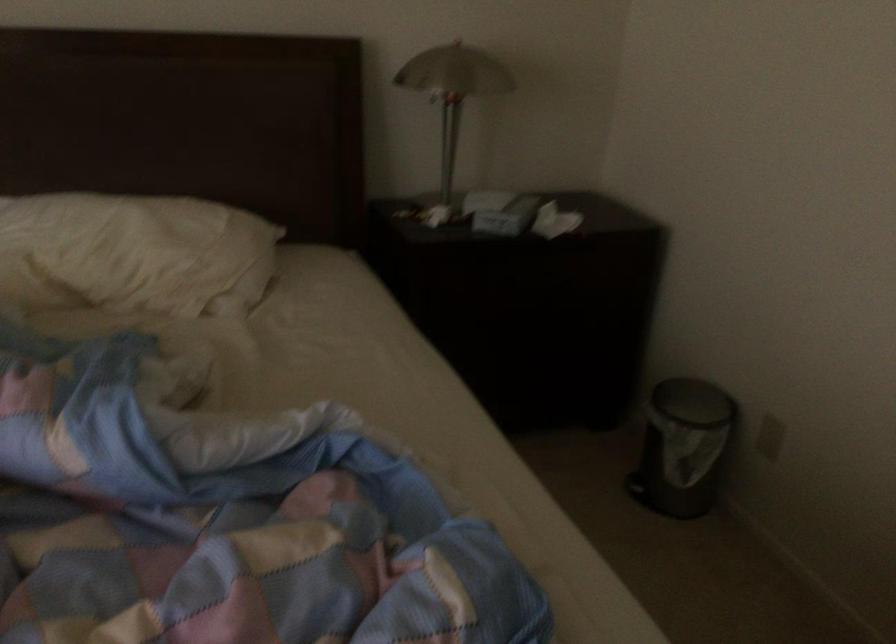
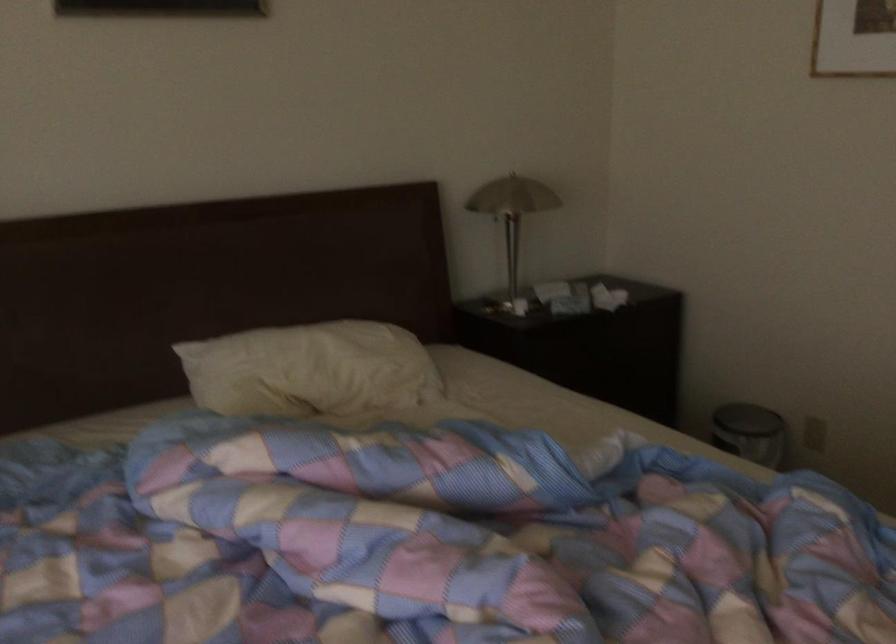
Question: The camera is either moving clockwise (left) or counter-clockwise (right) around the object. The first image is from the beginning of the video and the second image is from the end. Is the camera moving left or right when shooting the video?

Choices:
 (A) Left
 (B) Right

Answer: (A)